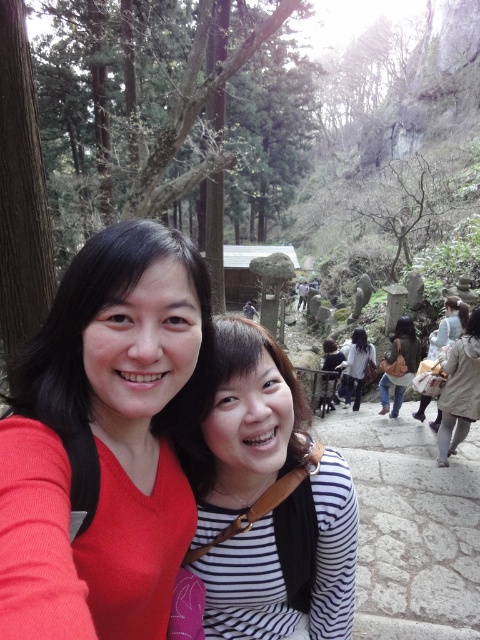
Question: Which point is closer to the camera?

Choices:
 (A) (440, 465)
 (B) (360, 353)
 (C) (410, 600)
 (D) (265, 566)

Answer: (D)

Question: Can you confirm if striped fabric shirt at center is positioned to the left of light beige coat at right?

Choices:
 (A) yes
 (B) no

Answer: (A)

Question: Is matte red sweater at left to the left of light beige coat at right from the viewer's perspective?

Choices:
 (A) no
 (B) yes

Answer: (B)

Question: Which point is farther from the camera taking this photo?

Choices:
 (A) (339, 428)
 (B) (211, 609)
 (C) (474, 317)
 (D) (351, 372)

Answer: (D)

Question: Estimate the real-world distances between objects in this image. Which object is farther from the matte red sweater at left?

Choices:
 (A) striped fabric shirt at center
 (B) gray stone steps at lower right
 (C) white cotton shirt at center

Answer: (C)

Question: Does light beige coat at right appear under white cotton shirt at center?

Choices:
 (A) no
 (B) yes

Answer: (A)